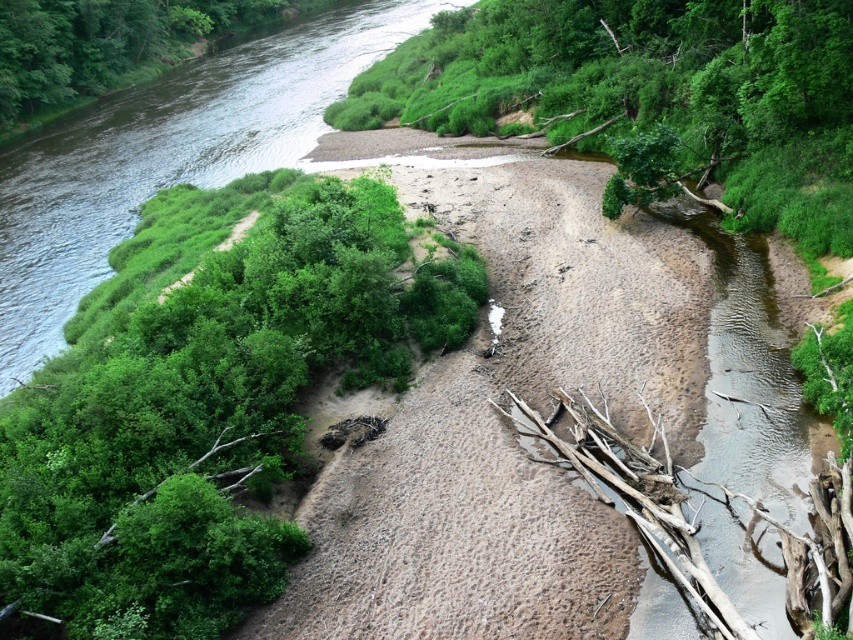
Is green leafy shrub at center-left taller than green leafy tree at upper left?

Incorrect, green leafy shrub at center-left's height is not larger of green leafy tree at upper left's.

Is point (181, 396) farther from viewer compared to point (86, 8)?

No, it is not.

Locate an element on the screen. The height and width of the screenshot is (640, 853). green leafy shrub at center-left is located at coordinates (204, 400).

Does point (421, 8) come in front of point (12, 86)?

No, it is not.

Can you confirm if green leafy vegetation at upper left is shorter than green leafy tree at upper left?

No, green leafy vegetation at upper left is not shorter than green leafy tree at upper left.

Who is more forward, (379, 42) or (148, 0)?

Point (379, 42)

Where is `green leafy vegetation at upper left`? The height and width of the screenshot is (640, 853). green leafy vegetation at upper left is located at coordinates 167,156.

Is green leafy shrub at center-left wider than green leafy vegetation at upper left?

No, green leafy shrub at center-left is not wider than green leafy vegetation at upper left.

Is point (222, 499) farther from viewer compared to point (310, 140)?

No, it is not.

The image size is (853, 640). In order to click on green leafy shrub at center-left in this screenshot , I will do `click(204, 400)`.

Where is `green leafy shrub at center-left`? green leafy shrub at center-left is located at coordinates (204, 400).